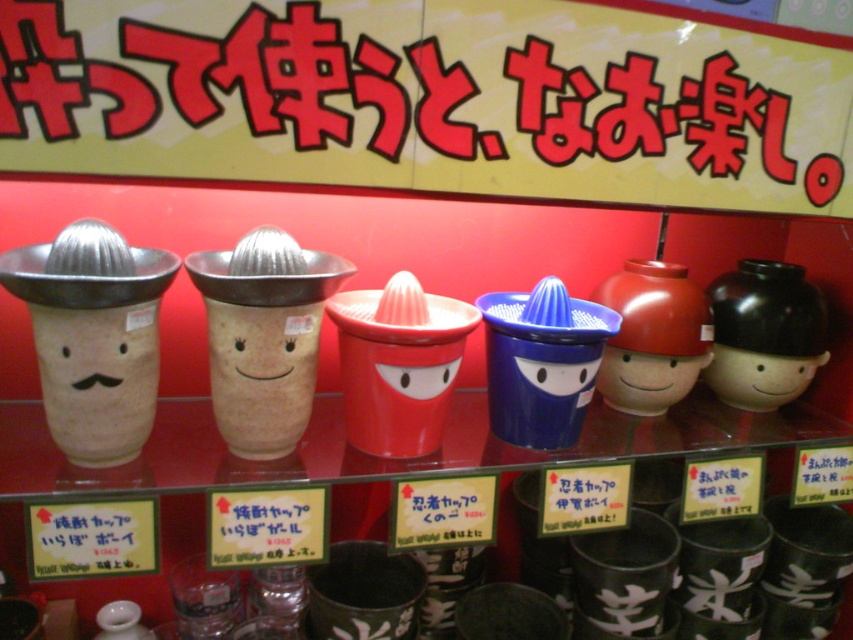
Question: Estimate the real-world distances between objects in this image. Which object is closer to the matte ceramic cup at center?

Choices:
 (A) matte ceramic face at left
 (B) brushed metal sign at upper center

Answer: (B)

Question: Is matte ceramic bowl at right to the right of matte ceramic cup at center from the viewer's perspective?

Choices:
 (A) yes
 (B) no

Answer: (A)

Question: Which point is closer to the camera taking this photo?

Choices:
 (A) (47, 392)
 (B) (608, 369)

Answer: (A)

Question: Can you confirm if brushed metal sign at upper center is thinner than matte ceramic cup at center?

Choices:
 (A) yes
 (B) no

Answer: (B)

Question: Is brushed metal sign at upper center below matte ceramic face at left?

Choices:
 (A) no
 (B) yes

Answer: (A)

Question: Which object is farther from the camera taking this photo?

Choices:
 (A) brushed metal sign at upper center
 (B) matte ceramic cup at center

Answer: (B)